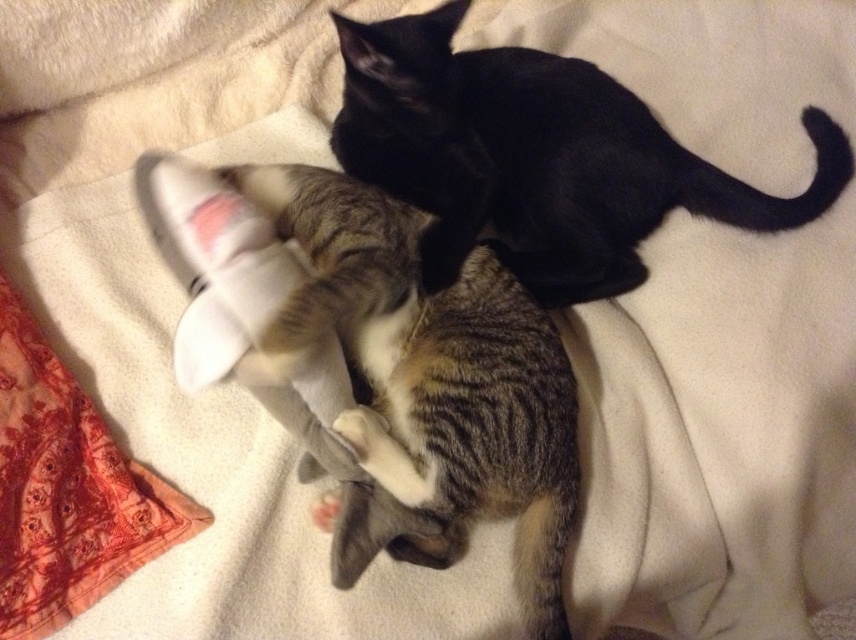
Can you confirm if striped fur cat at center is positioned above black glossy cat at upper center?

No.

Does point (550, 333) come closer to viewer compared to point (393, 52)?

That is False.

Describe the element at coordinates (434, 376) in the screenshot. I see `striped fur cat at center` at that location.

You are a GUI agent. You are given a task and a screenshot of the screen. Output one action in this format:
    pyautogui.click(x=<x>, y=<y>)
    Task: Click on the striped fur cat at center
    The height and width of the screenshot is (640, 856).
    Given the screenshot: What is the action you would take?
    pyautogui.click(x=434, y=376)